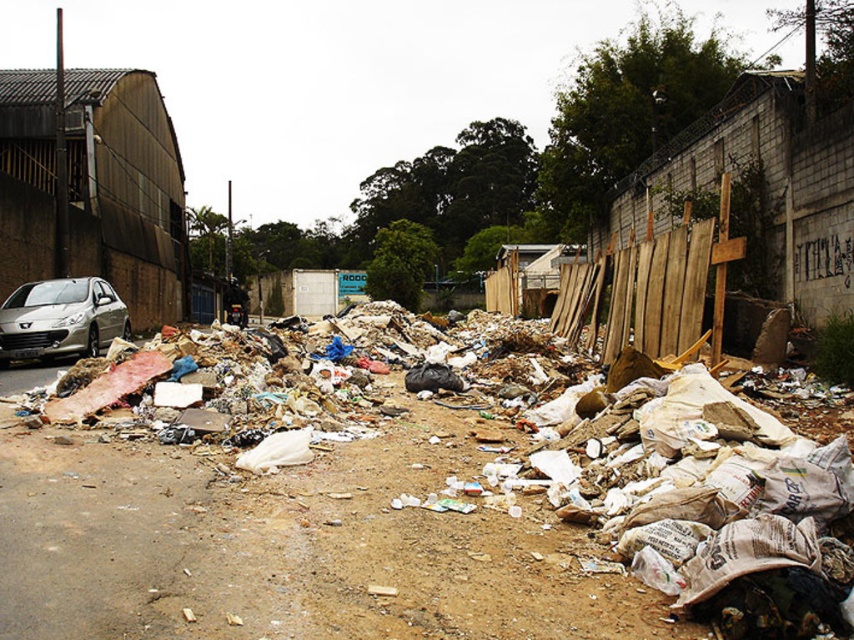
You are a delivery person who needs to unload a large package that requires 3 meters of space. You see the brown paper bags at center and the satin silver car at left in the scene. Which object occupies more space, and is there enough room to place the package next to them?

The brown paper bags at center is bigger than the satin silver car at left. Since the package requires 3 meters of space, it depends on the available space between them. However, the description only provides relative size information between the two objects, not their exact dimensions or distance apart. Without knowing the actual distance between the brown paper bags at center and the satin silver car at left, it is impossible to determine if there is enough room for the package.

You are a drone operator trying to capture aerial footage of the garbage pile. You notice two points of interest marked as point 1 at coordinates point (279, 419) and point 2 at coordinates point (54, 323). Which point is closer to your drone camera for better focus?

Point (279, 419) is closer to the camera than point (54, 323), so the drone should focus on point (279, 419) for better clarity.

You are standing at the point marked by the coordinates point (401, 506) in the image. Looking around, you see a large pile of garbage and debris. What object is located exactly at your current position?

The point (401, 506) corresponds to the location of the brown paper bags at center.